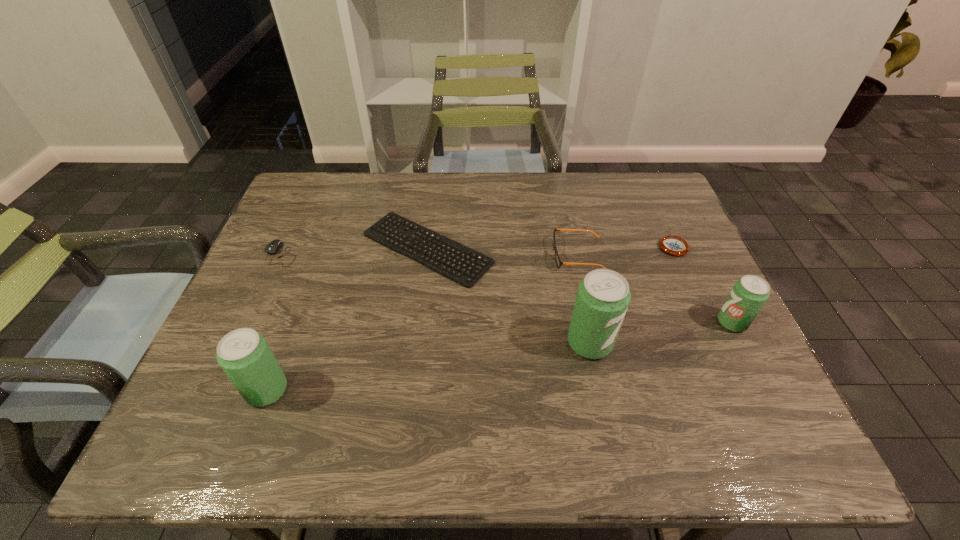
This screenshot has height=540, width=960. In order to click on compass in this screenshot , I will do `click(674, 245)`.

Identify the location of vacant region located 0.250m on the right of the leftmost soda. This screenshot has height=540, width=960. (409, 390).

Where is `vacant space situated 0.080m on the front of the second soda from left to right`? vacant space situated 0.080m on the front of the second soda from left to right is located at coordinates (601, 396).

What are the coordinates of `free location located on the left of the rightmost soda` in the screenshot? It's located at pyautogui.click(x=644, y=322).

Where is `free location located on the right of the third object from left to right`? free location located on the right of the third object from left to right is located at coordinates (530, 248).

Locate an element on the screen. This screenshot has height=540, width=960. vacant region located on the front of the leftmost object is located at coordinates (259, 302).

Image resolution: width=960 pixels, height=540 pixels. I want to click on vacant space located 0.390m on the front-facing side of the spectacles, so click(409, 255).

Identify the location of free spot located 0.050m on the front-facing side of the spectacles. Image resolution: width=960 pixels, height=540 pixels. (534, 255).

This screenshot has height=540, width=960. Identify the location of free space located on the front-facing side of the spectacles. (413, 255).

You are a GUI agent. You are given a task and a screenshot of the screen. Output one action in this format:
    pyautogui.click(x=<x>, y=<y>)
    Task: Click on the vacant area situated on the back of the compass
    
    Given the screenshot: What is the action you would take?
    pyautogui.click(x=659, y=214)